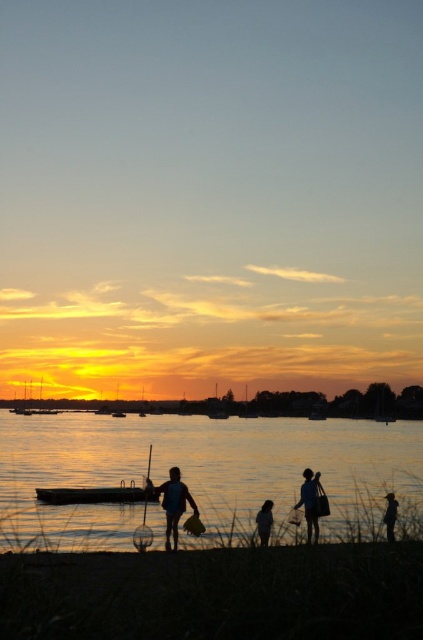
You are standing at the shoreline in the sunset scene and want to find the silvery water at lower center. According to the coordinates provided, where should you look relative to your position?

The silvery water at lower center is located at coordinates point (197, 472), which means it is positioned towards the lower right and slightly central area from your viewpoint on the shoreline.

You are standing at the shoreline in the sunset scene. You notice two points in the image labeled as point 1 and point 2. Point 1 is at coordinates point (176,540) and point 2 is at point (389,540). If you were to walk towards each point from your current position, which point would you reach first?

You would reach point 1 first because it is closer to you than point 2, which is further away.

You are a photographer planning to capture the sunset scene. You have a camera with a 10cm height limit for equipment. You see the wooden canoe at center and the silhouette backpack at lower right in your viewfinder. Which object might exceed the height limit and need to be adjusted?

The wooden canoe at center is much taller than the silhouette backpack at lower right, so it might exceed the 10cm height limit and need adjustment.